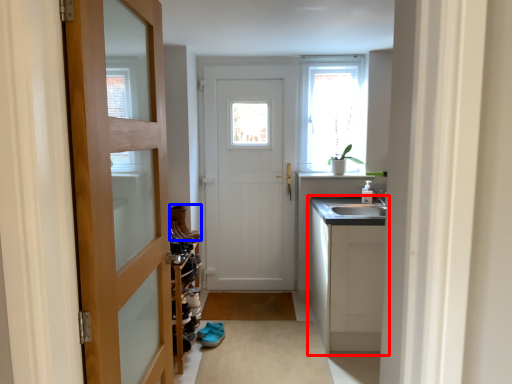
Question: Which of the following is the farthest to the observer, cabinetry (highlighted by a red box) or shoe (highlighted by a blue box)?

Choices:
 (A) cabinetry
 (B) shoe

Answer: (B)